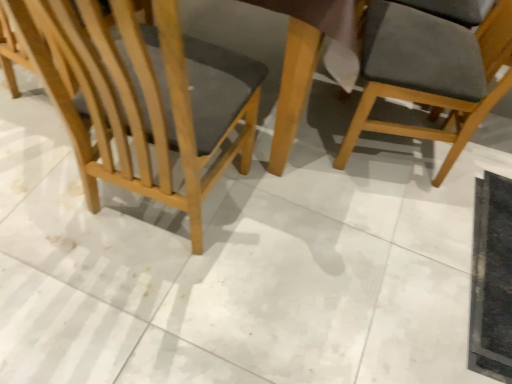
Question: From the image's perspective, relative to dark gray fabric chair at upper right, marked as the 1th chair in a right-to-left arrangement, is light brown wood chair at left, arranged as the first chair when viewed from the left, above or below?

Choices:
 (A) below
 (B) above

Answer: (A)

Question: Considering the positions of light brown wood chair at left, arranged as the first chair when viewed from the left, and dark gray fabric chair at upper right, the 2th chair positioned from the left, in the image, is light brown wood chair at left, arranged as the first chair when viewed from the left, wider or thinner than dark gray fabric chair at upper right, the 2th chair positioned from the left,?

Choices:
 (A) wide
 (B) thin

Answer: (A)

Question: From a real-world perspective, is light brown wood chair at left, acting as the 2th chair starting from the right, physically located above or below dark gray fabric chair at upper right, marked as the 1th chair in a right-to-left arrangement?

Choices:
 (A) above
 (B) below

Answer: (A)

Question: Is dark gray fabric chair at upper right, the 2th chair positioned from the left, to the left or to the right of light brown wood chair at left, acting as the 2th chair starting from the right, in the image?

Choices:
 (A) left
 (B) right

Answer: (B)

Question: Considering their positions, is dark gray fabric chair at upper right, marked as the 1th chair in a right-to-left arrangement, located in front of or behind light brown wood chair at left, arranged as the first chair when viewed from the left?

Choices:
 (A) behind
 (B) front

Answer: (A)

Question: Considering the positions of dark gray fabric chair at upper right, marked as the 1th chair in a right-to-left arrangement, and light brown wood chair at left, arranged as the first chair when viewed from the left, in the image, is dark gray fabric chair at upper right, marked as the 1th chair in a right-to-left arrangement, wider or thinner than light brown wood chair at left, arranged as the first chair when viewed from the left,?

Choices:
 (A) wide
 (B) thin

Answer: (B)

Question: From a real-world perspective, is dark gray fabric chair at upper right, the 2th chair positioned from the left, positioned above or below light brown wood chair at left, arranged as the first chair when viewed from the left?

Choices:
 (A) below
 (B) above

Answer: (A)